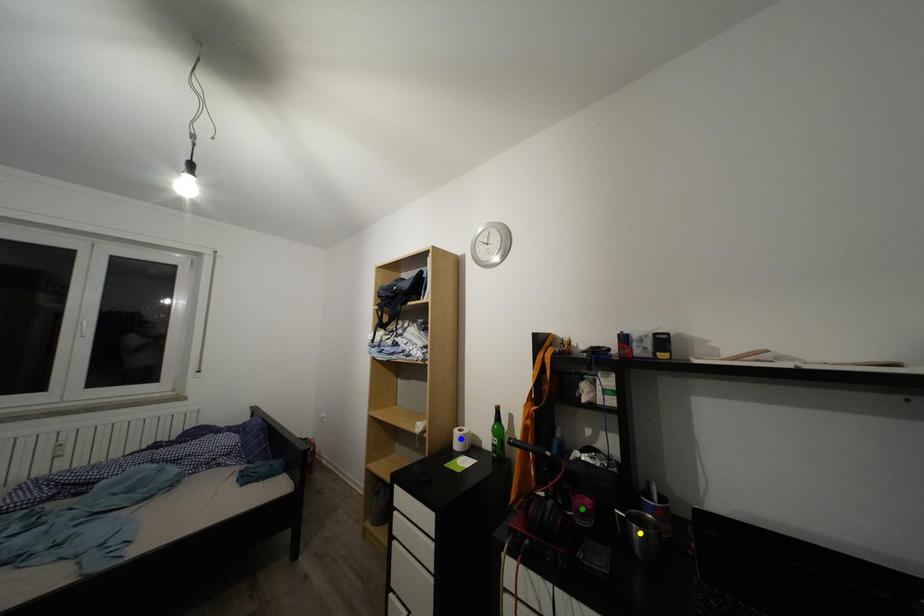
Order these from farthest to nearest:
yellow point | green point | blue point

blue point
green point
yellow point